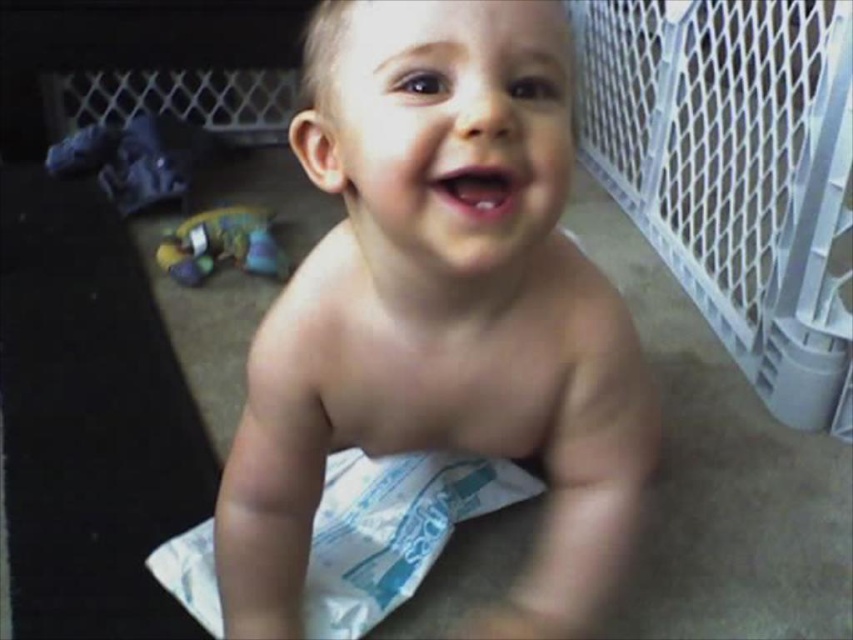
Question: Which object is the closest to the white cloth diaper at center?

Choices:
 (A) white paper diaper at center
 (B) plush multicolored toy at lower left

Answer: (A)

Question: Which point appears farthest from the camera in this image?

Choices:
 (A) (440, 362)
 (B) (218, 248)

Answer: (B)

Question: Which point is farther to the camera?

Choices:
 (A) (341, 595)
 (B) (541, 186)

Answer: (A)

Question: Does white cloth diaper at center appear on the right side of plush multicolored toy at lower left?

Choices:
 (A) no
 (B) yes

Answer: (B)

Question: Can you confirm if white paper diaper at center is smaller than plush multicolored toy at lower left?

Choices:
 (A) no
 (B) yes

Answer: (A)

Question: Observing the image, what is the correct spatial positioning of white cloth diaper at center in reference to plush multicolored toy at lower left?

Choices:
 (A) right
 (B) left

Answer: (A)